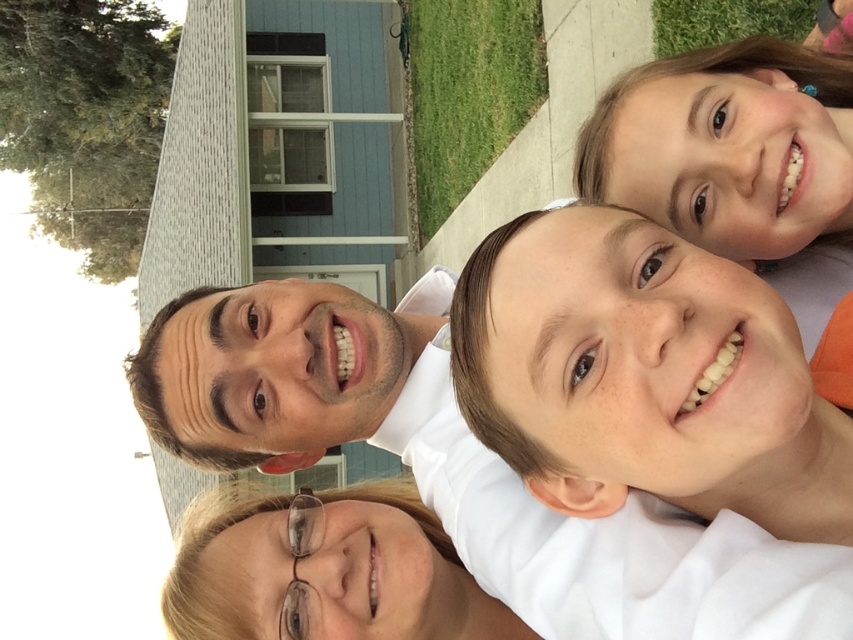
Question: Can you confirm if white smooth shirt at center is positioned above green grass at upper center?

Choices:
 (A) no
 (B) yes

Answer: (A)

Question: Based on their relative distances, which object is farther from the green grass at upper center?

Choices:
 (A) white smooth shirt at center
 (B) green grass at lower left
 (C) clear plastic glasses at lower center

Answer: (B)

Question: Can you confirm if white smooth shirt at center is smaller than clear plastic glasses at lower center?

Choices:
 (A) no
 (B) yes

Answer: (B)

Question: Which point is farther to the camera?

Choices:
 (A) clear plastic glasses at lower center
 (B) green grass at lower left
 (C) green grass at upper center
 (D) white smooth shirt at center

Answer: (B)

Question: Does white smooth shirt at center come in front of green grass at lower left?

Choices:
 (A) yes
 (B) no

Answer: (A)

Question: Which point is closer to the camera?

Choices:
 (A) (677, 461)
 (B) (770, 3)

Answer: (A)